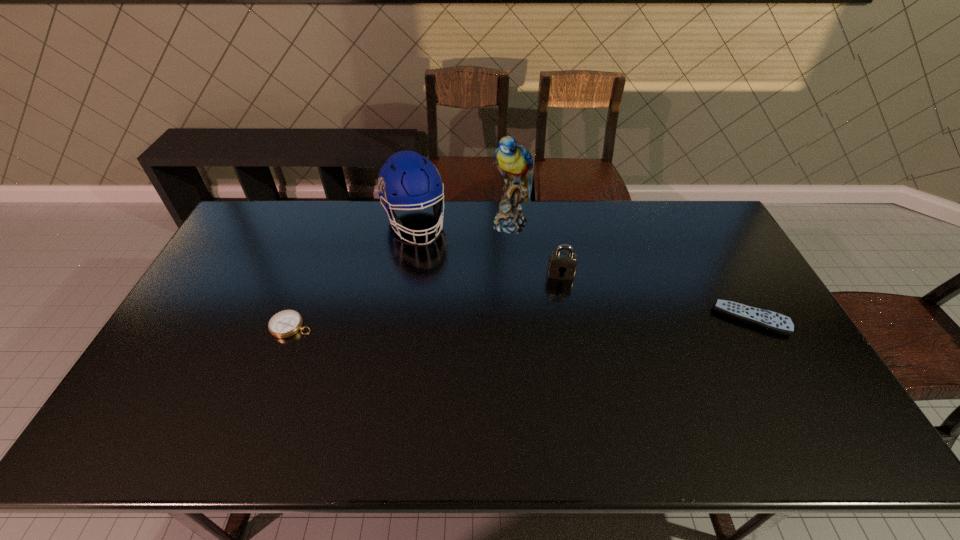
Where is `empty location between the second object from left to right and the leftmost object`? empty location between the second object from left to right and the leftmost object is located at coordinates (353, 275).

The height and width of the screenshot is (540, 960). I want to click on free point between the football helmet and the tallest object, so click(463, 223).

In order to click on free space between the fourth shortest object and the compass in this screenshot , I will do `click(353, 275)`.

The height and width of the screenshot is (540, 960). Find the location of `free spot between the rightmost object and the leftmost object`. free spot between the rightmost object and the leftmost object is located at coordinates (521, 322).

Find the location of a particular element. This screenshot has width=960, height=540. empty space that is in between the remote control and the tallest object is located at coordinates (631, 271).

What are the coordinates of `free space that is in between the tallest object and the rightmost object` in the screenshot? It's located at (631, 271).

Point out which object is positioned as the fourth nearest to the leftmost object. Please provide its 2D coordinates. Your answer should be formatted as a tuple, i.e. [(x, y)], where the tuple contains the x and y coordinates of a point satisfying the conditions above.

[(765, 319)]

Where is `object that is the second closest one to the fourth object from right to left`? object that is the second closest one to the fourth object from right to left is located at coordinates (286, 323).

What are the coordinates of `vacant space that satisfies the following two spatial constraints: 1. on the back side of the fourth object from right to left; 2. on the right side of the leftmost object` in the screenshot? It's located at (331, 223).

This screenshot has height=540, width=960. Identify the location of free space that satisfies the following two spatial constraints: 1. on the back side of the compass; 2. on the left side of the remote control. pyautogui.click(x=294, y=319).